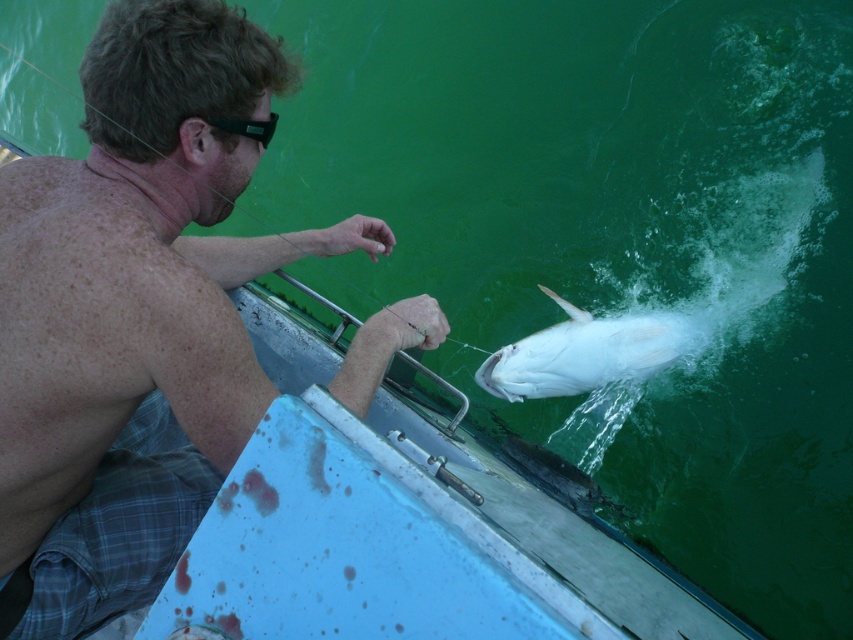
You are a photographer on the boat and want to capture a photo of the white glossy fish at lower center without the black plastic goggles at upper left appearing in the frame. Is this possible given their positions?

The white glossy fish at lower center is positioned under the black plastic goggles at upper left, so the goggles would block the view of the fish. Therefore, it is not possible to take a photo of the white glossy fish at lower center without the black plastic goggles at upper left appearing in the frame.

You are a photographer trying to capture a closeup shot of both the shiny skin man at upper left and the white glossy fish at lower center. Given their current positions, can you fit both subjects into one frame without zooming in? The camera has a standard lens with a field of view that can capture objects up to 5 feet apart in the same frame.

The shiny skin man at upper left and the white glossy fish at lower center are 4.02 feet apart from each other. Since the camera can capture objects up to 5 feet apart, both subjects can be included in one frame without zooming in.